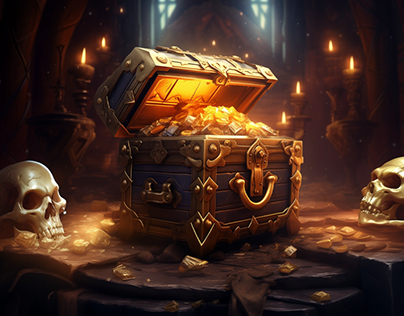
Where is `candles`? candles is located at coordinates click(x=333, y=205), click(x=351, y=74), click(x=331, y=50), click(x=301, y=93), click(x=284, y=122), click(x=86, y=70), click(x=103, y=47).